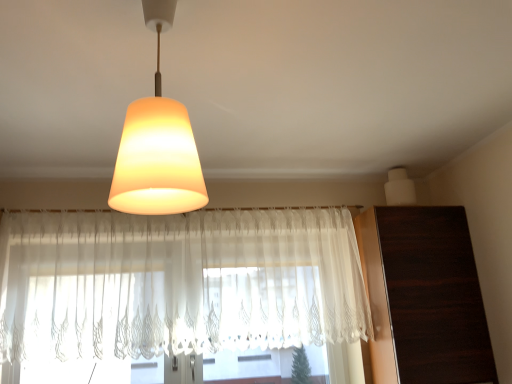
What do you see at coordinates (157, 145) in the screenshot? The height and width of the screenshot is (384, 512). I see `matte glass lampshade at upper center, arranged as the first lamp when viewed from the left` at bounding box center [157, 145].

What is the approximate height of white matte speaker at upper right, the 1th lamp in the back-to-front sequence?

It is 15.76 centimeters.

Find the location of a particular element. This screenshot has height=384, width=512. white matte speaker at upper right, the second lamp viewed from the left is located at coordinates (399, 188).

Identify the location of dark wood dresser at right. The height and width of the screenshot is (384, 512). (424, 297).

This screenshot has width=512, height=384. I want to click on white sheer curtain at center, so click(178, 283).

Which of these two, white sheer curtain at center or dark wood dresser at right, stands shorter?

white sheer curtain at center.

Which object is positioned more to the left, white sheer curtain at center or dark wood dresser at right?

Positioned to the left is white sheer curtain at center.

From a real-world perspective, between white sheer curtain at center and dark wood dresser at right, who is vertically lower?

dark wood dresser at right, from a real-world perspective.

Is dark wood dresser at right a part of white sheer curtain at center?

No, dark wood dresser at right is located outside of white sheer curtain at center.

Is dark wood dresser at right oriented towards matte glass lampshade at upper center, arranged as the first lamp when viewed from the left?

No, dark wood dresser at right does not turn towards matte glass lampshade at upper center, arranged as the first lamp when viewed from the left.

Based on the photo, considering the sizes of objects dark wood dresser at right and matte glass lampshade at upper center, positioned as the 2th lamp in back-to-front order, in the image provided, who is taller, dark wood dresser at right or matte glass lampshade at upper center, positioned as the 2th lamp in back-to-front order,?

With more height is dark wood dresser at right.

Considering the positions of objects dark wood dresser at right and matte glass lampshade at upper center, marked as the second lamp in a right-to-left arrangement, in the image provided, who is behind, dark wood dresser at right or matte glass lampshade at upper center, marked as the second lamp in a right-to-left arrangement,?

dark wood dresser at right is behind.

Which of these two, white sheer curtain at center or matte glass lampshade at upper center, positioned as the 2th lamp in back-to-front order, is wider?

Wider between the two is matte glass lampshade at upper center, positioned as the 2th lamp in back-to-front order.

Is white sheer curtain at center situated inside matte glass lampshade at upper center, arranged as the first lamp when viewed from the left, or outside?

The correct answer is: outside.

You are a GUI agent. You are given a task and a screenshot of the screen. Output one action in this format:
    pyautogui.click(x=<x>, y=<y>)
    Task: Click on the curtain that appears on the left of matte glass lampshade at upper center, positioned as the 2th lamp in back-to-front order
    
    Given the screenshot: What is the action you would take?
    pyautogui.click(x=178, y=283)

Between point (18, 216) and point (117, 200), which one is positioned behind?

Point (18, 216)

Can you confirm if dark wood dresser at right is positioned to the right of white sheer curtain at center?

Yes.

Is white sheer curtain at center a part of dark wood dresser at right?

That's incorrect, white sheer curtain at center is not inside dark wood dresser at right.

Is the position of dark wood dresser at right more distant than that of white sheer curtain at center?

Yes, it is behind white sheer curtain at center.

I want to click on curtain on the left of dark wood dresser at right, so click(178, 283).

Is matte glass lampshade at upper center, marked as the second lamp in a right-to-left arrangement, positioned beyond the bounds of white matte speaker at upper right, acting as the 1th lamp starting from the right?

Yes, matte glass lampshade at upper center, marked as the second lamp in a right-to-left arrangement, is located beyond the bounds of white matte speaker at upper right, acting as the 1th lamp starting from the right.

From a real-world perspective, is matte glass lampshade at upper center, marked as the second lamp in a right-to-left arrangement, over white matte speaker at upper right, acting as the 1th lamp starting from the right?

Actually, matte glass lampshade at upper center, marked as the second lamp in a right-to-left arrangement, is physically below white matte speaker at upper right, acting as the 1th lamp starting from the right, in the real world.

From the image's perspective, would you say matte glass lampshade at upper center, which is counted as the first lamp, starting from the front, is positioned over white matte speaker at upper right, which appears as the 2th lamp when viewed from the front?

Indeed, from the image's perspective, matte glass lampshade at upper center, which is counted as the first lamp, starting from the front, is shown above white matte speaker at upper right, which appears as the 2th lamp when viewed from the front.

The image size is (512, 384). In order to click on lamp behind the matte glass lampshade at upper center, positioned as the 2th lamp in back-to-front order in this screenshot , I will do `click(399, 188)`.

Does white matte speaker at upper right, acting as the 1th lamp starting from the right, turn towards white sheer curtain at center?

No, white matte speaker at upper right, acting as the 1th lamp starting from the right, is not turned towards white sheer curtain at center.

Choose the correct answer: Is white matte speaker at upper right, the second lamp viewed from the left, inside white sheer curtain at center or outside it?

white matte speaker at upper right, the second lamp viewed from the left, cannot be found inside white sheer curtain at center.

Which is behind, point (413, 198) or point (314, 284)?

The point (413, 198) is more distant.

Is dark wood dresser at right to the left of white matte speaker at upper right, the 1th lamp in the back-to-front sequence, from the viewer's perspective?

No.

From a real-world perspective, starting from the dark wood dresser at right, which lamp is the 2nd one vertically above it? Please provide its 2D coordinates.

[(399, 188)]

Does point (393, 336) appear closer or farther from the camera than point (406, 202)?

Point (393, 336) is closer to the camera than point (406, 202).

This screenshot has height=384, width=512. Identify the location of curtain that appears above the dark wood dresser at right (from a real-world perspective). (178, 283).

From the image's perspective, which lamp is the 2nd one above the dark wood dresser at right? Please provide its 2D coordinates.

[(157, 145)]

Based on the photo, based on their spatial positions, is matte glass lampshade at upper center, which is counted as the first lamp, starting from the front, or white matte speaker at upper right, the 1th lamp in the back-to-front sequence, further from dark wood dresser at right?

The object further to dark wood dresser at right is matte glass lampshade at upper center, which is counted as the first lamp, starting from the front.

Considering their positions, is white sheer curtain at center positioned closer to white matte speaker at upper right, acting as the 1th lamp starting from the right, than dark wood dresser at right?

dark wood dresser at right lies closer to white matte speaker at upper right, acting as the 1th lamp starting from the right, than the other object.

When comparing their distances from matte glass lampshade at upper center, marked as the second lamp in a right-to-left arrangement, does white sheer curtain at center or white matte speaker at upper right, the 1th lamp in the back-to-front sequence, seem closer?

Among the two, white sheer curtain at center is located nearer to matte glass lampshade at upper center, marked as the second lamp in a right-to-left arrangement.

When comparing their distances from matte glass lampshade at upper center, positioned as the 2th lamp in back-to-front order, does dark wood dresser at right or white sheer curtain at center seem further?

dark wood dresser at right is positioned further to the anchor matte glass lampshade at upper center, positioned as the 2th lamp in back-to-front order.

Which object lies further to the anchor point white sheer curtain at center, dark wood dresser at right or white matte speaker at upper right, the second lamp viewed from the left?

Among the two, white matte speaker at upper right, the second lamp viewed from the left, is located further to white sheer curtain at center.

Considering their positions, is white matte speaker at upper right, the second lamp viewed from the left, positioned further to matte glass lampshade at upper center, marked as the second lamp in a right-to-left arrangement, than dark wood dresser at right?

The object further to matte glass lampshade at upper center, marked as the second lamp in a right-to-left arrangement, is white matte speaker at upper right, the second lamp viewed from the left.

Based on their spatial positions, is white sheer curtain at center or white matte speaker at upper right, acting as the 1th lamp starting from the right, closer to dark wood dresser at right?

white matte speaker at upper right, acting as the 1th lamp starting from the right, lies closer to dark wood dresser at right than the other object.

When comparing their distances from white matte speaker at upper right, the 1th lamp in the back-to-front sequence, does white sheer curtain at center or matte glass lampshade at upper center, marked as the second lamp in a right-to-left arrangement, seem further?

matte glass lampshade at upper center, marked as the second lamp in a right-to-left arrangement, is positioned further to the anchor white matte speaker at upper right, the 1th lamp in the back-to-front sequence.

Image resolution: width=512 pixels, height=384 pixels. In order to click on curtain located between matte glass lampshade at upper center, arranged as the first lamp when viewed from the left, and white matte speaker at upper right, acting as the 1th lamp starting from the right, in the depth direction in this screenshot , I will do `click(178, 283)`.

Find the location of `dresser between matte glass lampshade at upper center, positioned as the 2th lamp in back-to-front order, and white matte speaker at upper right, the second lamp viewed from the left, in the front-back direction`. dresser between matte glass lampshade at upper center, positioned as the 2th lamp in back-to-front order, and white matte speaker at upper right, the second lamp viewed from the left, in the front-back direction is located at coordinates (424, 297).